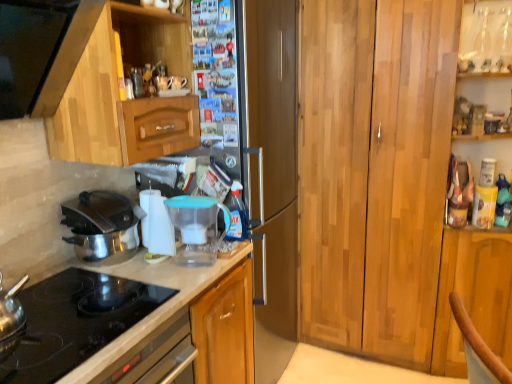
What are the coordinates of `free spot in front of transparent plastic bottle at center` in the screenshot? It's located at (218, 258).